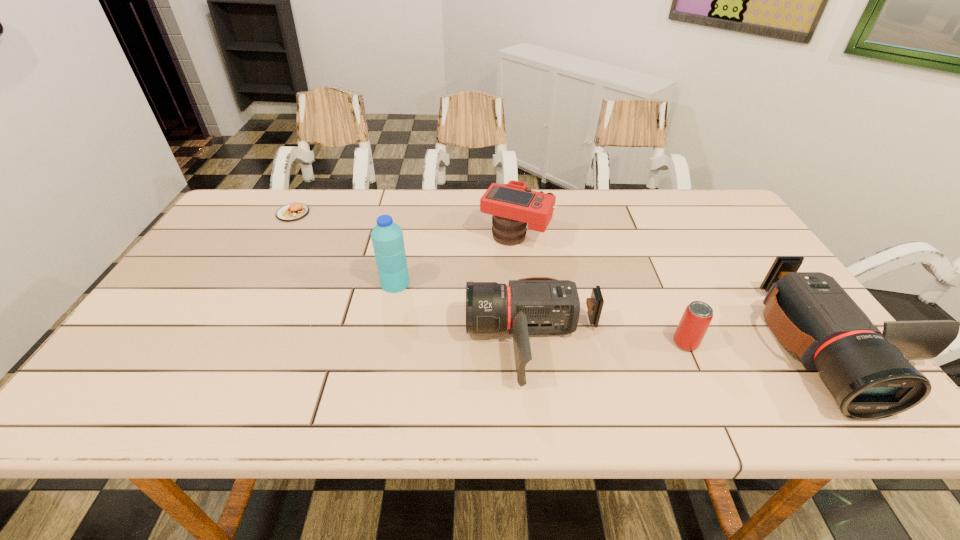
At what (x,y) coordinates should I click in order to perform the action: click on the left camcorder. Please return your answer as a coordinate pair (x, y). The width and height of the screenshot is (960, 540). Looking at the image, I should click on (536, 305).

The width and height of the screenshot is (960, 540). Identify the location of the leftmost object. (291, 212).

I want to click on the shortest object, so click(x=291, y=212).

Image resolution: width=960 pixels, height=540 pixels. I want to click on camera, so click(x=513, y=205).

Locate an element on the screen. The height and width of the screenshot is (540, 960). the tallest object is located at coordinates (387, 237).

Find the location of a particular element. Image resolution: width=960 pixels, height=540 pixels. water bottle is located at coordinates (387, 237).

At what (x,y) coordinates should I click in order to perform the action: click on the fifth object from left to right. Please return your answer as a coordinate pair (x, y). Looking at the image, I should click on (694, 323).

You are a GUI agent. You are given a task and a screenshot of the screen. Output one action in this format:
    pyautogui.click(x=<x>, y=<y>)
    Task: Click on the free space located on the lens of the left camcorder
    This screenshot has height=540, width=960.
    Given the screenshot: What is the action you would take?
    pyautogui.click(x=390, y=341)

Image resolution: width=960 pixels, height=540 pixels. What are the coordinates of `vacant region located on the lens of the left camcorder` in the screenshot? It's located at coord(350,341).

Find the location of `free spot located 0.280m on the lens of the left camcorder`. free spot located 0.280m on the lens of the left camcorder is located at coordinates (347, 341).